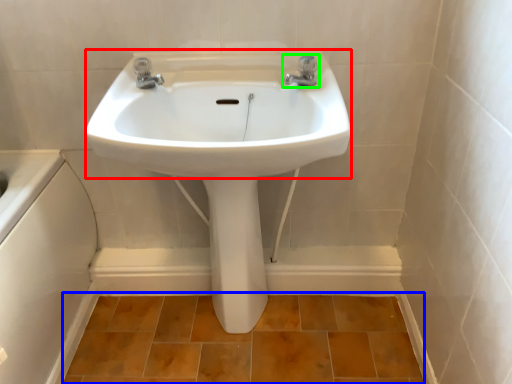
Question: Which is farther away from sink (highlighted by a red box)? ceramic tile (highlighted by a blue box) or tap (highlighted by a green box)?

Choices:
 (A) ceramic tile
 (B) tap

Answer: (A)